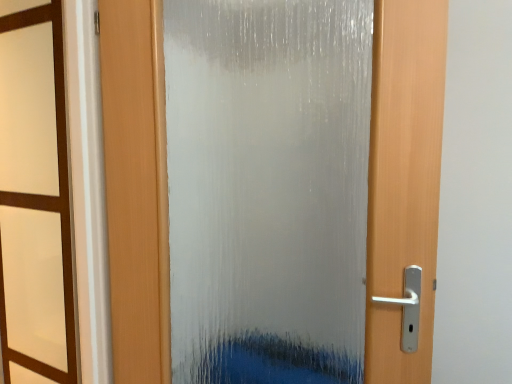
At what (x,y) coordinates should I click in order to perform the action: click on frosted glass door at center. Please return your answer as a coordinate pair (x, y). Looking at the image, I should click on (404, 178).

What do you see at coordinates (404, 178) in the screenshot?
I see `frosted glass door at center` at bounding box center [404, 178].

In order to face brown wood window frame at left, should I rotate leftwards or rightwards?

Turn left approximately 27.620 degrees to face it.

The width and height of the screenshot is (512, 384). Identify the location of brown wood window frame at left. pyautogui.click(x=35, y=202).

This screenshot has height=384, width=512. What do you see at coordinates (35, 202) in the screenshot? I see `brown wood window frame at left` at bounding box center [35, 202].

The height and width of the screenshot is (384, 512). What are the coordinates of `frosted glass door at center` in the screenshot? It's located at (404, 178).

Considering the positions of objects frosted glass door at center and brown wood window frame at left in the image provided, who is more to the left, frosted glass door at center or brown wood window frame at left?

brown wood window frame at left is more to the left.

Is frosted glass door at center in front of or behind brown wood window frame at left in the image?

Clearly, frosted glass door at center is behind brown wood window frame at left.

Is point (119, 13) closer or farther from the camera than point (51, 257)?

Point (119, 13) appears to be closer to the viewer than point (51, 257).

From the image's perspective, is frosted glass door at center beneath brown wood window frame at left?

No.

From a real-world perspective, who is located higher, frosted glass door at center or brown wood window frame at left?

From a 3D spatial view, brown wood window frame at left is above.

Based on the photo, considering the sizes of objects frosted glass door at center and brown wood window frame at left in the image provided, who is wider, frosted glass door at center or brown wood window frame at left?

frosted glass door at center is wider.

In the scene shown: Is frosted glass door at center taller or shorter than brown wood window frame at left?

In the image, frosted glass door at center appears to be taller than brown wood window frame at left.

Can you confirm if frosted glass door at center is bigger than brown wood window frame at left?

Yes, frosted glass door at center is bigger than brown wood window frame at left.

Is frosted glass door at center inside the boundaries of brown wood window frame at left, or outside?

frosted glass door at center is spatially situated outside brown wood window frame at left.

Would you consider frosted glass door at center to be distant from brown wood window frame at left?

frosted glass door at center is actually quite close to brown wood window frame at left.

Is frosted glass door at center aimed at brown wood window frame at left?

No, frosted glass door at center is not facing towards brown wood window frame at left.

How different are the orientations of frosted glass door at center and brown wood window frame at left in degrees?

The angle between the facing direction of frosted glass door at center and the facing direction of brown wood window frame at left is 65 degrees.

Locate an element on the screen. door located underneath the brown wood window frame at left (from a real-world perspective) is located at coordinates (404, 178).

Which object is positioned more to the right, brown wood window frame at left or frosted glass door at center?

From the viewer's perspective, frosted glass door at center appears more on the right side.

Based on the photo, relative to frosted glass door at center, is brown wood window frame at left in front or behind?

brown wood window frame at left is in front of frosted glass door at center.

Which is in front, point (55, 282) or point (145, 193)?

Point (145, 193)

From the image's perspective, is brown wood window frame at left above or below frosted glass door at center?

brown wood window frame at left is situated lower than frosted glass door at center in the image.

From a real-world perspective, is brown wood window frame at left physically located above or below frosted glass door at center?

From a real-world perspective, brown wood window frame at left is physically above frosted glass door at center.

Does brown wood window frame at left have a lesser width compared to frosted glass door at center?

Yes, brown wood window frame at left is thinner than frosted glass door at center.

Who is taller, brown wood window frame at left or frosted glass door at center?

frosted glass door at center.

Which of these two, brown wood window frame at left or frosted glass door at center, is smaller?

With smaller size is brown wood window frame at left.

Is brown wood window frame at left outside of frosted glass door at center?

Yes, brown wood window frame at left is outside of frosted glass door at center.

Is brown wood window frame at left beside frosted glass door at center?

There is a gap between brown wood window frame at left and frosted glass door at center.

Could you tell me if brown wood window frame at left is facing frosted glass door at center?

No, brown wood window frame at left is not facing towards frosted glass door at center.

What's the angular difference between brown wood window frame at left and frosted glass door at center's facing directions?

The angular difference between brown wood window frame at left and frosted glass door at center is 65 degrees.

You are a GUI agent. You are given a task and a screenshot of the screen. Output one action in this format:
    pyautogui.click(x=<x>, y=<y>)
    Task: Click on the door above the brown wood window frame at left (from the image's perspective)
    This screenshot has height=384, width=512.
    Given the screenshot: What is the action you would take?
    pyautogui.click(x=404, y=178)

This screenshot has width=512, height=384. Identify the location of door below the brown wood window frame at left (from a real-world perspective). (404, 178).

Identify the location of door above the brown wood window frame at left (from the image's perspective). (404, 178).